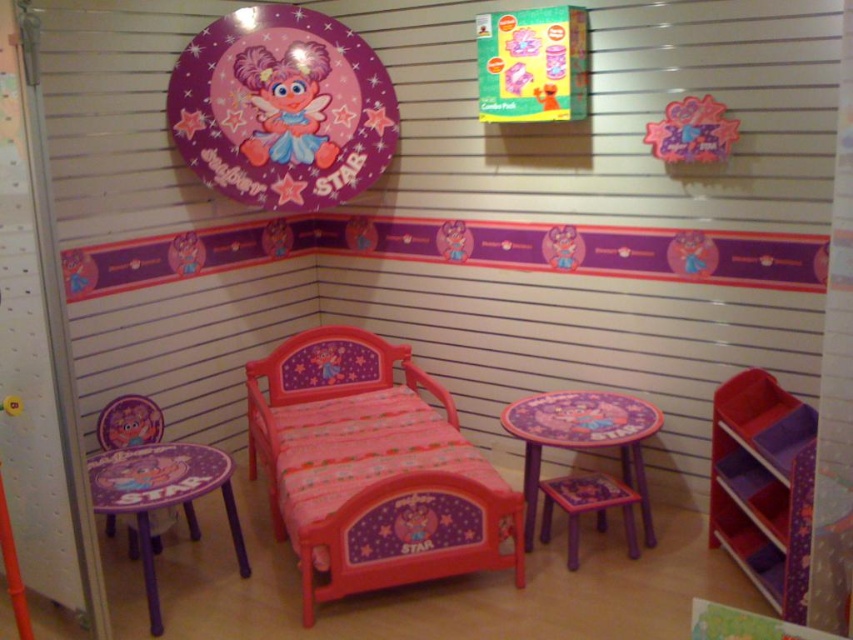
Can you confirm if purple plastic table at center is shorter than purple plastic stool at lower center?

No, purple plastic table at center is not shorter than purple plastic stool at lower center.

Can you confirm if purple plastic table at center is thinner than purple plastic stool at lower center?

Incorrect, purple plastic table at center's width is not less than purple plastic stool at lower center's.

Locate an element on the screen. purple plastic table at center is located at coordinates (582, 438).

Identify the location of purple plastic table at center. (582, 438).

Is purple plastic table at lower left behind matte pink doll at upper center?

No, it is in front of matte pink doll at upper center.

Can you confirm if purple plastic table at lower left is positioned above matte pink doll at upper center?

No, purple plastic table at lower left is not above matte pink doll at upper center.

This screenshot has height=640, width=853. I want to click on purple plastic table at lower left, so pyautogui.click(x=161, y=497).

Between matte plastic bed at center and matte pink doll at upper center, which one appears on the right side from the viewer's perspective?

matte plastic bed at center

Identify the location of matte plastic bed at center. The width and height of the screenshot is (853, 640). (370, 468).

The height and width of the screenshot is (640, 853). I want to click on matte plastic bed at center, so click(x=370, y=468).